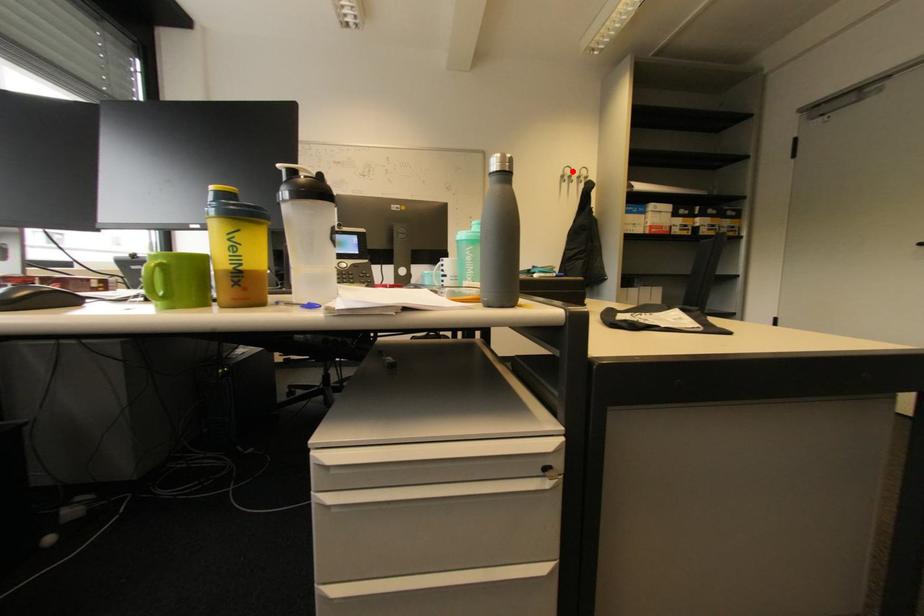
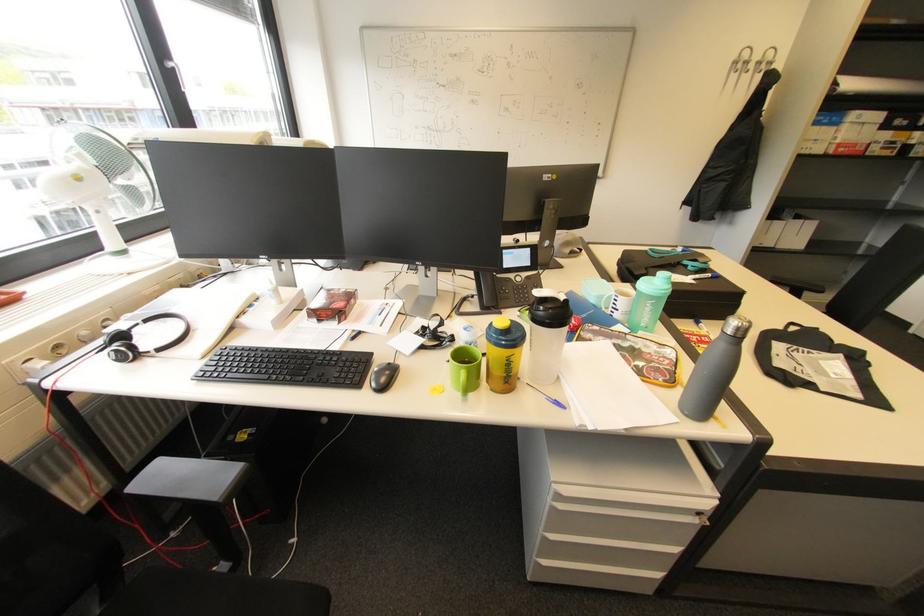
Question: I am providing you with two images of the same scene from different viewpoints. Image1 has a red point marked. In image2, the corresponding 3D location appears at what relative position? Reply with the corresponding letter.

Choices:
 (A) Closer
 (B) Farther

Answer: (B)